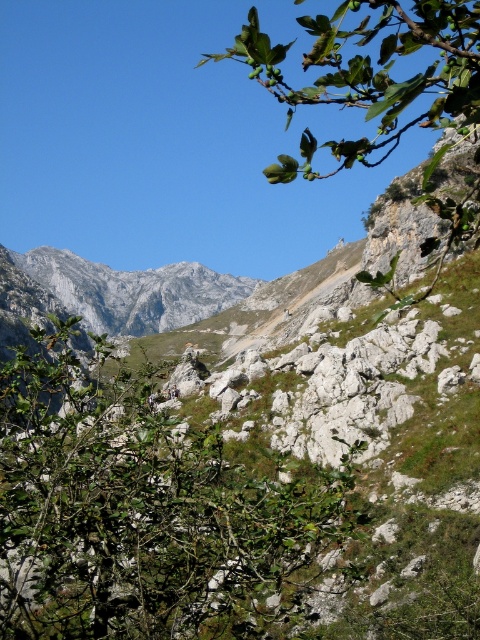
You are a hiker standing in the mountainous landscape and want to take a photo of both the green leafy shrub at center and the green leafy branch at upper right. Which object should you focus on first to ensure both are in the frame?

You should focus on the green leafy shrub at center first because it is closer to you than the green leafy branch at upper right, so adjusting the camera to include both would require ensuring the closer object is framed properly first.

You are a hiker standing at the point marked as point [141,509] in the image. What do you see directly in front of you?

You see a green leafy shrub at center directly in front of you at point [141,509].